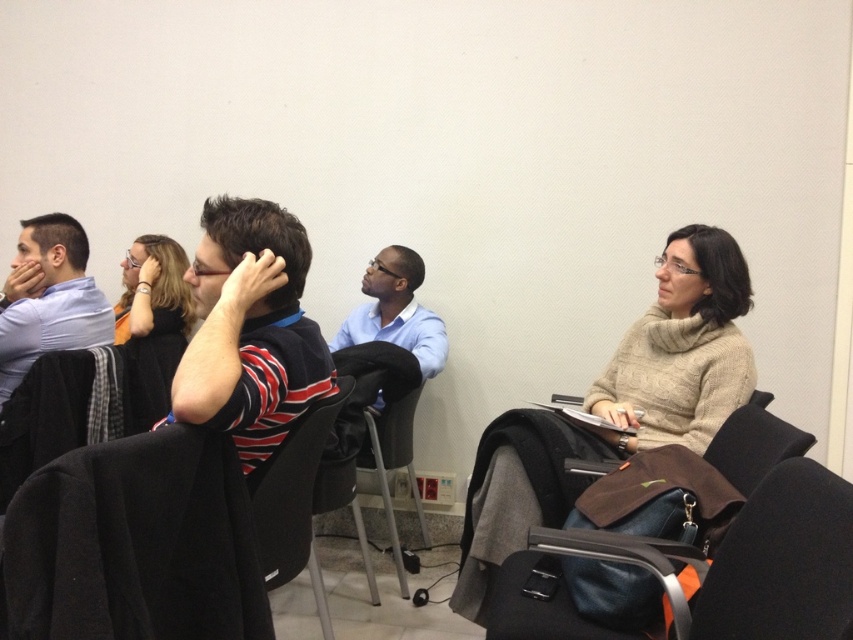
Question: Does black leather chair at lower right come behind metallic gray chair at center?

Choices:
 (A) yes
 (B) no

Answer: (B)

Question: Which of the following is the farthest from the observer?

Choices:
 (A) black leather chair at lower right
 (B) metallic gray chair at center

Answer: (B)

Question: Can you confirm if black leather chair at lower right is positioned above black fabric chair at center?

Choices:
 (A) yes
 (B) no

Answer: (B)

Question: Is matte blue shirt at left below black fabric chair at center?

Choices:
 (A) yes
 (B) no

Answer: (B)

Question: Which object is positioned farthest from the black fabric chair at center?

Choices:
 (A) light blue shirt at center
 (B) metallic gray chair at center

Answer: (A)

Question: Which of the following is the farthest from the observer?

Choices:
 (A) (50, 280)
 (B) (828, 582)

Answer: (A)